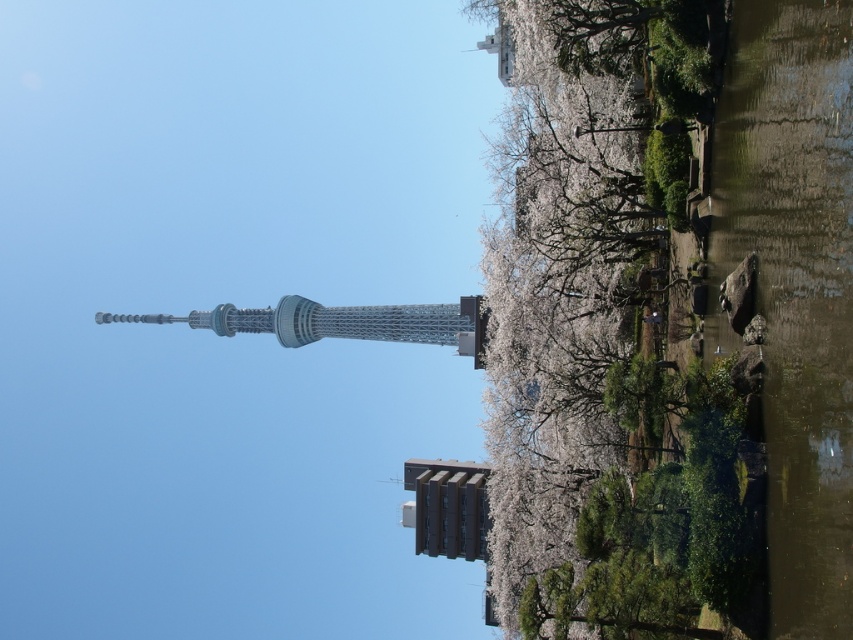
Question: Which object is the farthest from the metallic silver tower at center?

Choices:
 (A) metallic gray building at center
 (B) greenish-brown water at lower right

Answer: (B)

Question: Considering the relative positions of white blossoming tree at center and greenish-brown water at lower right in the image provided, where is white blossoming tree at center located with respect to greenish-brown water at lower right?

Choices:
 (A) below
 (B) above

Answer: (A)

Question: Among these points, which one is farthest from the camera?

Choices:
 (A) (463, 323)
 (B) (482, 477)
 (C) (495, 356)

Answer: (A)

Question: Which point is farther from the camera taking this photo?

Choices:
 (A) (556, 435)
 (B) (805, 412)
 (C) (432, 529)

Answer: (C)

Question: Can you confirm if white blossoming tree at center is positioned to the right of metallic gray building at center?

Choices:
 (A) no
 (B) yes

Answer: (B)

Question: Is white blossoming tree at center positioned behind metallic gray building at center?

Choices:
 (A) yes
 (B) no

Answer: (B)